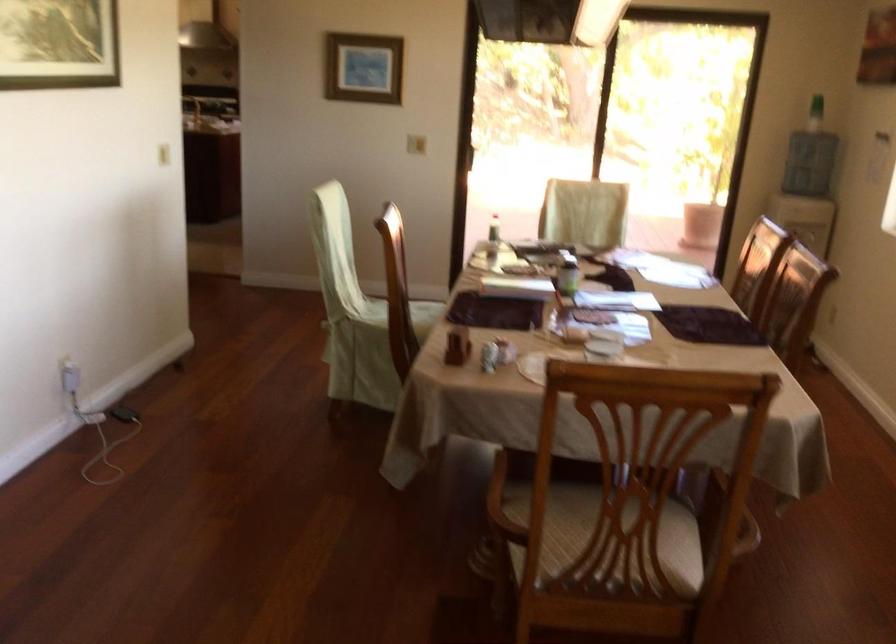
The location [566,272] corresponds to which object?

It refers to a green label jar.